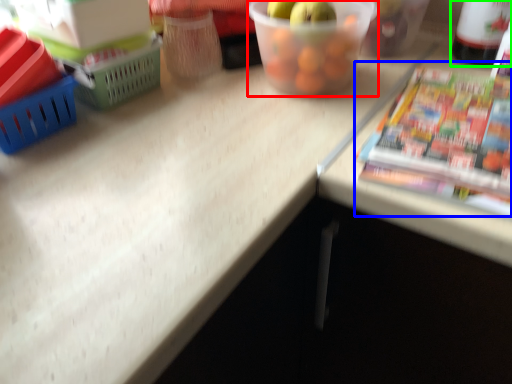
Question: Which object is positioned closest to glass bowl (highlighted by a red box)? Select from paperback book (highlighted by a blue box) and bottle (highlighted by a green box).

Choices:
 (A) paperback book
 (B) bottle

Answer: (A)